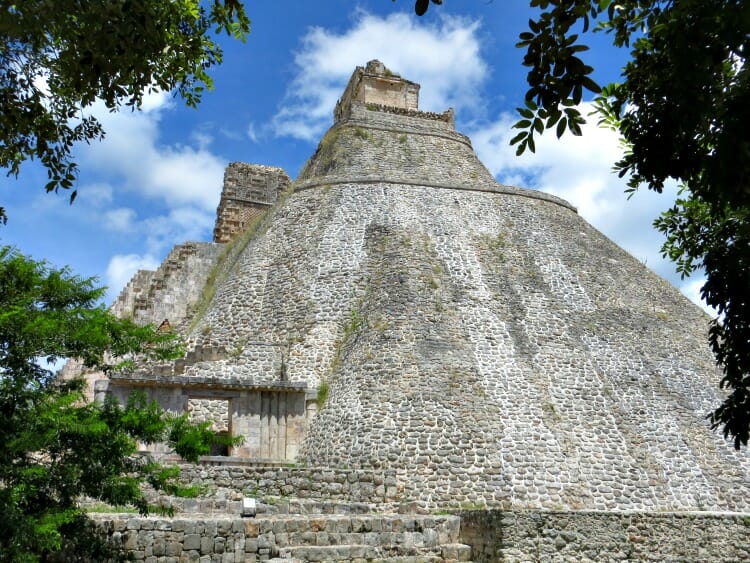
Find the location of a particular element. The image size is (750, 563). doorway into another section of the stone structure is located at coordinates (206, 410).